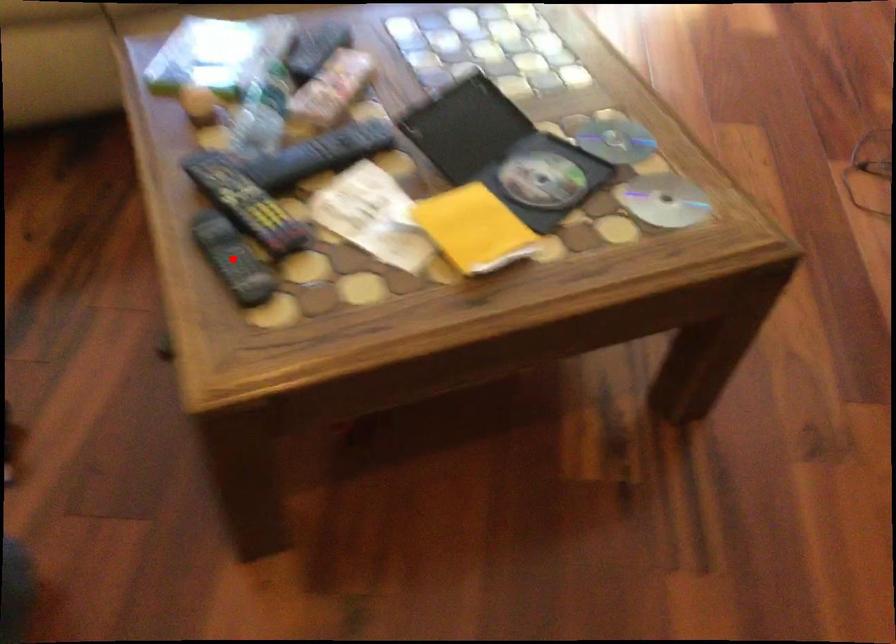
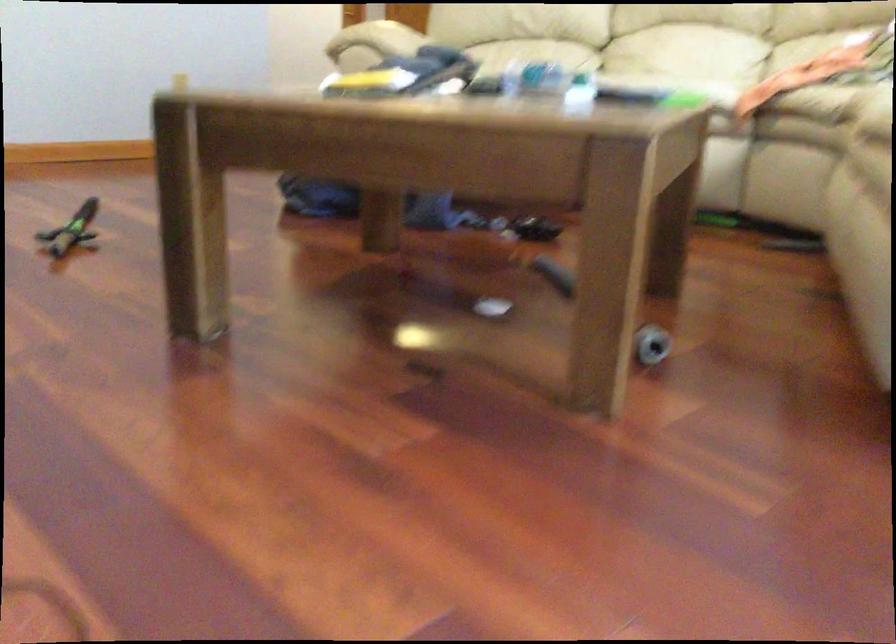
Question: I am providing you with two images of the same scene from different viewpoints. A red point is marked on the first image. At the location where the point appears in image 1, is it still visible in image 2?

Choices:
 (A) Yes
 (B) No

Answer: (B)